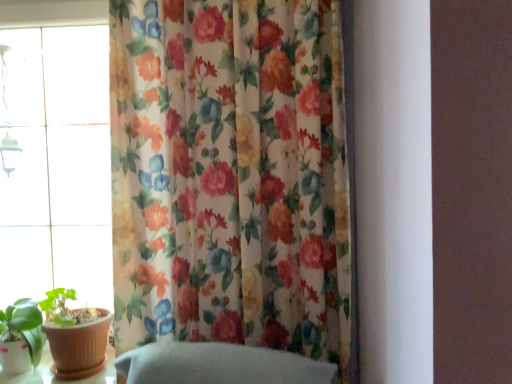
Question: In terms of width, does floral fabric curtain at center look wider or thinner when compared to green matte leaf at lower left?

Choices:
 (A) thin
 (B) wide

Answer: (A)

Question: From a real-world perspective, is floral fabric curtain at center physically located above or below green matte leaf at lower left?

Choices:
 (A) below
 (B) above

Answer: (B)

Question: Considering the real-world distances, which object is closest to the transparent glass window at left?

Choices:
 (A) floral fabric curtain at center
 (B) green matte leaf at lower left

Answer: (B)

Question: Which of these objects is positioned farthest from the transparent glass window at left?

Choices:
 (A) green matte leaf at lower left
 (B) floral fabric curtain at center

Answer: (B)